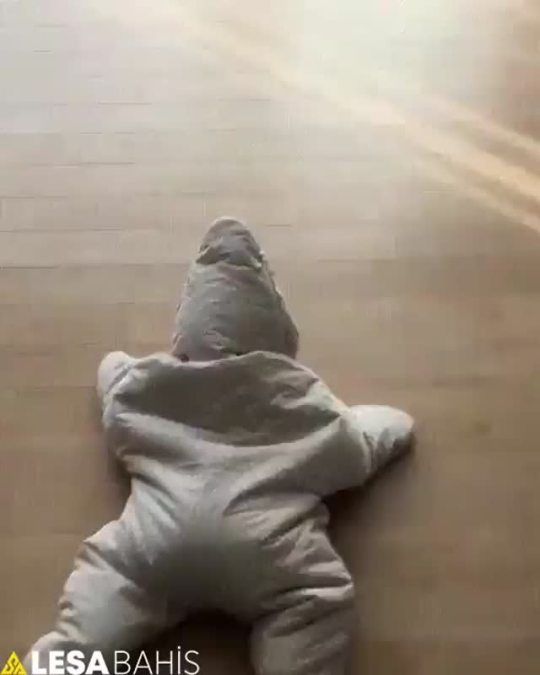
Identify the location of floor. (417, 538).